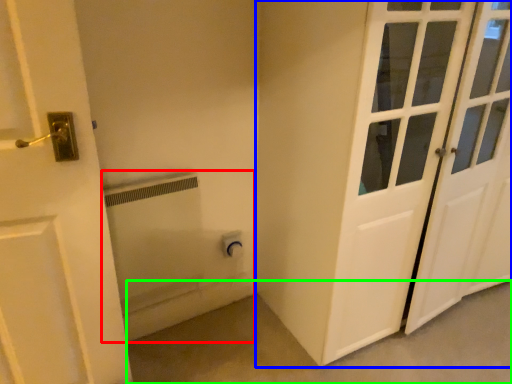
Question: Which object is positioned closest to bath (highlighted by a red box)? Select from door (highlighted by a blue box) and concrete (highlighted by a green box).

Choices:
 (A) door
 (B) concrete

Answer: (B)